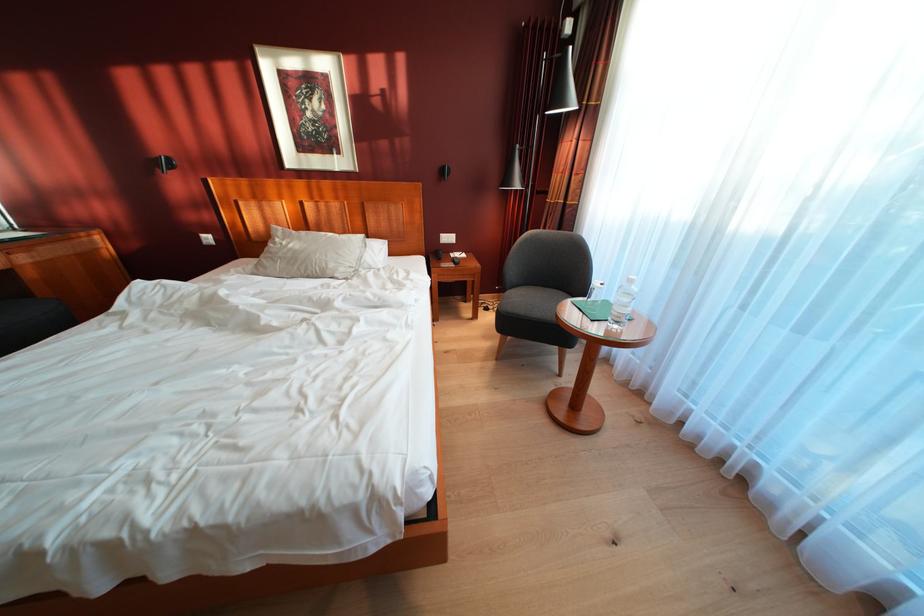
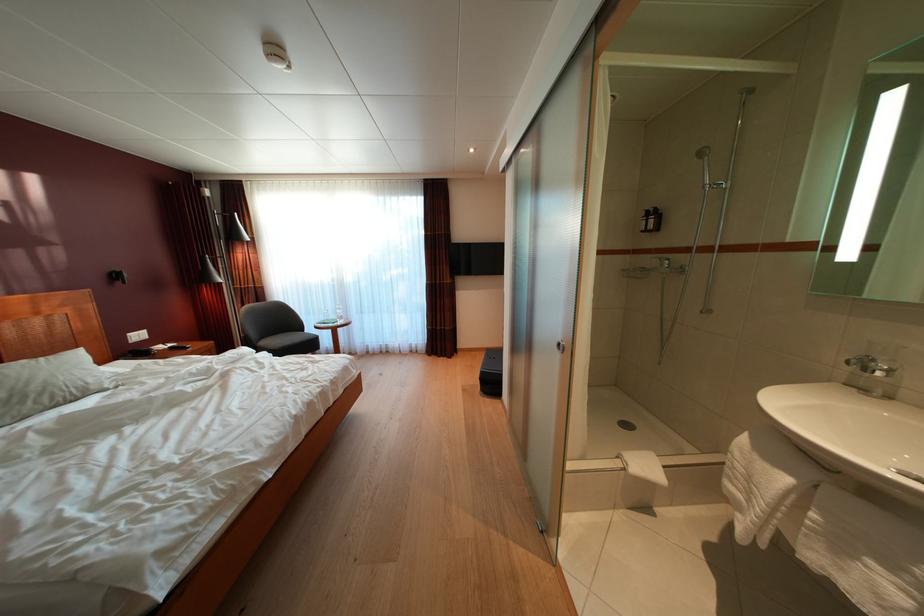
Locate, in the second image, the point that corresponds to (298,262) in the first image.

(10, 400)